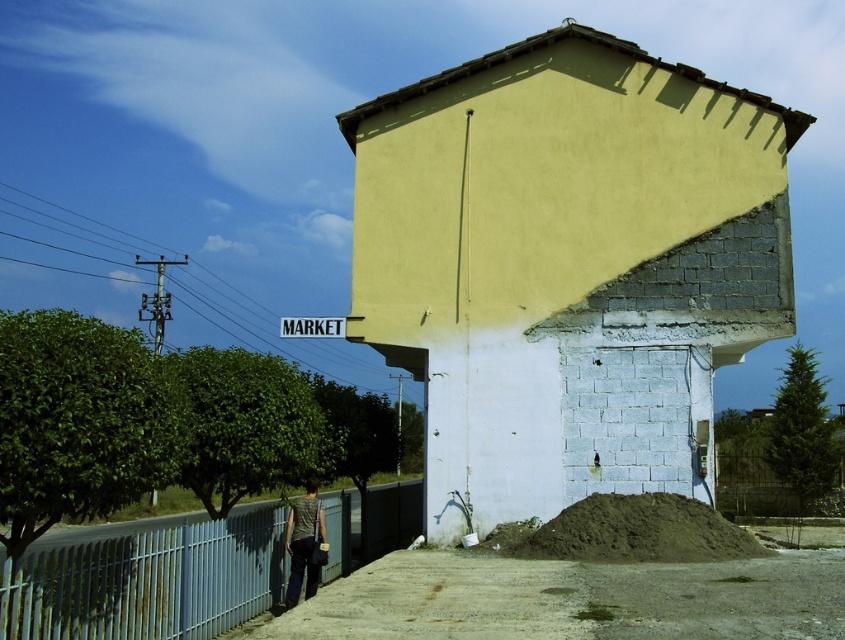
Which is below, green fabric shirt at lower center or blue plastic sign at upper center?

green fabric shirt at lower center

Between point (297, 592) and point (331, 328), which one is positioned behind?

Point (331, 328)

At what (x,y) coordinates should I click in order to perform the action: click on green fabric shirt at lower center. Please return your answer as a coordinate pair (x, y). Looking at the image, I should click on (304, 541).

Is point (684, 516) in front of point (344, 326)?

Yes, point (684, 516) is closer to viewer.

Between brown dirt at lower right and blue plastic sign at upper center, which one appears on the right side from the viewer's perspective?

Positioned to the right is brown dirt at lower right.

Where is `brown dirt at lower right`? The width and height of the screenshot is (845, 640). brown dirt at lower right is located at coordinates (639, 531).

Who is positioned more to the right, blue painted metal fence at lower left or brown dirt at lower right?

brown dirt at lower right is more to the right.

Who is shorter, blue painted metal fence at lower left or brown dirt at lower right?

Standing shorter between the two is brown dirt at lower right.

Is point (50, 616) closer to camera compared to point (606, 531)?

Yes, point (50, 616) is in front of point (606, 531).

Find the location of `blue painted metal fence at lower left`. blue painted metal fence at lower left is located at coordinates (150, 582).